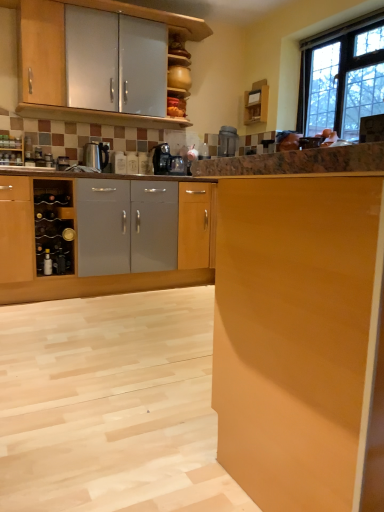
The height and width of the screenshot is (512, 384). What do you see at coordinates (62, 163) in the screenshot? I see `metallic silver wine rack at left, the 2th appliance when ordered from top to bottom` at bounding box center [62, 163].

You are a GUI agent. You are given a task and a screenshot of the screen. Output one action in this format:
    pyautogui.click(x=<x>, y=<y>)
    Task: Click on the metallic silver bottle at lower left
    The height and width of the screenshot is (512, 384).
    Given the screenshot: What is the action you would take?
    pyautogui.click(x=47, y=263)

Find the location of a particular element. This screenshot has width=384, height=512. wooden cabinet at upper center, the first cabinetry positioned from the back is located at coordinates (256, 103).

The image size is (384, 512). In order to click on matte wood cabinet at right, which is counted as the 1th cabinetry, starting from the front in this screenshot , I will do `click(293, 334)`.

Find the location of a particular element. The image size is (384, 512). wooden wine rack at left is located at coordinates (11, 150).

This screenshot has height=512, width=384. I want to click on metallic silver kettle at left, so click(x=96, y=155).

What do you see at coordinates (205, 361) in the screenshot? The image size is (384, 512). I see `light wood cabinet at lower left, the 2th cabinetry from the back` at bounding box center [205, 361].

Locate an element on the screen. light wood cabinet at lower left, the 1th cabinetry when ordered from bottom to top is located at coordinates (205, 361).

I want to click on black plastic coffee machine at center, so click(168, 161).

Can black plastic coffee machine at center be found inside metallic silver toaster at upper center, the second appliance when ordered from left to right?

No, black plastic coffee machine at center is not inside metallic silver toaster at upper center, the second appliance when ordered from left to right.

Could you tell me if metallic silver toaster at upper center, which ranks as the 1th appliance in top-to-bottom order, is turned towards black plastic coffee machine at center?

No.

Considering the positions of objects metallic silver toaster at upper center, which is the 2th appliance in bottom-to-top order, and black plastic coffee machine at center in the image provided, who is more to the left, metallic silver toaster at upper center, which is the 2th appliance in bottom-to-top order, or black plastic coffee machine at center?

From the viewer's perspective, black plastic coffee machine at center appears more on the left side.

Considering the sizes of objects metallic silver toaster at upper center, the second appliance when ordered from left to right, and black plastic coffee machine at center in the image provided, who is shorter, metallic silver toaster at upper center, the second appliance when ordered from left to right, or black plastic coffee machine at center?

Standing shorter between the two is black plastic coffee machine at center.

I want to click on window above the light wood cabinet at lower left, acting as the third cabinetry starting from the top (from a real-world perspective), so click(x=335, y=65).

Is light wood cabinet at lower left, acting as the third cabinetry starting from the top, shorter than clear glass window at upper right?

Correct, light wood cabinet at lower left, acting as the third cabinetry starting from the top, is not as tall as clear glass window at upper right.

Between light wood cabinet at lower left, the 1th cabinetry when ordered from bottom to top, and clear glass window at upper right, which one has larger width?

light wood cabinet at lower left, the 1th cabinetry when ordered from bottom to top.

Between wooden wine rack at left and light wood cabinet at lower left, the 1th cabinetry when ordered from bottom to top, which one appears on the left side from the viewer's perspective?

wooden wine rack at left.

From the image's perspective, is wooden wine rack at left below light wood cabinet at lower left, the 2th cabinetry from the back?

Incorrect, from the image's perspective, wooden wine rack at left is higher than light wood cabinet at lower left, the 2th cabinetry from the back.

Are wooden wine rack at left and light wood cabinet at lower left, the 2th cabinetry from the back, making contact?

No, wooden wine rack at left is not beside light wood cabinet at lower left, the 2th cabinetry from the back.

Does wooden wine rack at left have a smaller size compared to light wood cabinet at lower left, which is the 2th cabinetry from front to back?

Indeed, wooden wine rack at left has a smaller size compared to light wood cabinet at lower left, which is the 2th cabinetry from front to back.

Looking at this image, is clear glass window at upper right facing towards metallic silver toaster at upper center, the second appliance when ordered from left to right?

No, clear glass window at upper right does not turn towards metallic silver toaster at upper center, the second appliance when ordered from left to right.

Who is more distant, clear glass window at upper right or metallic silver toaster at upper center, the 1th appliance when ordered from back to front?

metallic silver toaster at upper center, the 1th appliance when ordered from back to front, is more distant.

How distant is clear glass window at upper right from metallic silver toaster at upper center, the 1th appliance positioned from the right?

The distance of clear glass window at upper right from metallic silver toaster at upper center, the 1th appliance positioned from the right, is 1.18 meters.

Does clear glass window at upper right have a greater width compared to metallic silver toaster at upper center, the 1th appliance positioned from the right?

Incorrect, the width of clear glass window at upper right does not surpass that of metallic silver toaster at upper center, the 1th appliance positioned from the right.

Can you confirm if metallic silver bottle at lower left is thinner than black plastic coffee machine at center?

Indeed, metallic silver bottle at lower left has a lesser width compared to black plastic coffee machine at center.

Is black plastic coffee machine at center at the back of metallic silver bottle at lower left?

No, metallic silver bottle at lower left is not facing the opposite direction of black plastic coffee machine at center.

This screenshot has width=384, height=512. Find the location of `bottle on the left of black plastic coffee machine at center`. bottle on the left of black plastic coffee machine at center is located at coordinates 47,263.

From the image's perspective, which one is positioned higher, metallic silver bottle at lower left or black plastic coffee machine at center?

From the image's view, black plastic coffee machine at center is above.

Which is correct: wooden wine rack at left is inside wooden cabinet at upper center, which appears as the third cabinetry when viewed from the front, or outside of it?

wooden wine rack at left is spatially situated outside wooden cabinet at upper center, which appears as the third cabinetry when viewed from the front.

Does wooden wine rack at left have a larger size compared to wooden cabinet at upper center, the first cabinetry positioned from the back?

No, wooden wine rack at left is not bigger than wooden cabinet at upper center, the first cabinetry positioned from the back.

Looking at this image, from the image's perspective, which is below, wooden wine rack at left or wooden cabinet at upper center, acting as the third cabinetry starting from the bottom?

wooden wine rack at left appears lower in the image.

Is the surface of wooden wine rack at left in direct contact with wooden cabinet at upper center, acting as the third cabinetry starting from the bottom?

wooden wine rack at left is not next to wooden cabinet at upper center, acting as the third cabinetry starting from the bottom, and they're not touching.

Is metallic silver bottle at lower left turned away from metallic silver toaster at upper center, the second appliance when ordered from left to right?

No, metallic silver bottle at lower left is not facing the opposite direction of metallic silver toaster at upper center, the second appliance when ordered from left to right.

Considering the relative sizes of metallic silver bottle at lower left and metallic silver toaster at upper center, the second appliance when ordered from left to right, in the image provided, is metallic silver bottle at lower left shorter than metallic silver toaster at upper center, the second appliance when ordered from left to right,?

Correct, metallic silver bottle at lower left is not as tall as metallic silver toaster at upper center, the second appliance when ordered from left to right.

Which is nearer, (46, 267) or (226, 136)?

Point (46, 267) appears to be closer to the viewer than point (226, 136).

Where is `appliance that is the 2nd object located above the metallic silver bottle at lower left (from the image's perspective)`? appliance that is the 2nd object located above the metallic silver bottle at lower left (from the image's perspective) is located at coordinates (227, 141).

The width and height of the screenshot is (384, 512). There is a black plastic coffee machine at center. What are the coordinates of `appliance above it (from a real-world perspective)` in the screenshot? It's located at (227, 141).

From a real-world perspective, starting from the clear glass window at upper right, which cabinetry is the 3rd one below it? Please provide its 2D coordinates.

[(205, 361)]

Looking at the image, which one is located further to metallic silver bottle at lower left, wooden wine rack at left or metallic silver wine rack at left, positioned as the first appliance in bottom-to-top order?

Based on the image, wooden wine rack at left appears to be further to metallic silver bottle at lower left.

Estimate the real-world distances between objects in this image. Which object is closer to clear glass window at upper right, metallic silver bottle at lower left or wooden cabinet at upper center, acting as the third cabinetry starting from the bottom?

Among the two, wooden cabinet at upper center, acting as the third cabinetry starting from the bottom, is located nearer to clear glass window at upper right.

Based on their spatial positions, is metallic silver bottle at lower left or wooden cabinet at upper center, acting as the third cabinetry starting from the bottom, closer to metallic silver kettle at left?

metallic silver bottle at lower left is closer to metallic silver kettle at left.

From the image, which object appears to be nearer to light wood cabinet at lower left, the 1th cabinetry when ordered from bottom to top, metallic silver toaster at upper center, which ranks as the 1th appliance in top-to-bottom order, or wooden wine rack at left?

metallic silver toaster at upper center, which ranks as the 1th appliance in top-to-bottom order, lies closer to light wood cabinet at lower left, the 1th cabinetry when ordered from bottom to top, than the other object.

When comparing their distances from metallic silver wine rack at left, the 2th appliance viewed from the right, does metallic silver toaster at upper center, which ranks as the 1th appliance in top-to-bottom order, or clear glass window at upper right seem closer?

The object closer to metallic silver wine rack at left, the 2th appliance viewed from the right, is metallic silver toaster at upper center, which ranks as the 1th appliance in top-to-bottom order.

Considering their positions, is wooden wine rack at left positioned further to metallic silver toaster at upper center, which is the 2th appliance in bottom-to-top order, than metallic silver bottle at lower left?

wooden wine rack at left lies further to metallic silver toaster at upper center, which is the 2th appliance in bottom-to-top order, than the other object.

From the image, which object appears to be nearer to metallic silver bottle at lower left, black plastic coffee machine at center or wooden wine rack at left?

Based on the image, wooden wine rack at left appears to be nearer to metallic silver bottle at lower left.

Considering their positions, is light wood cabinet at lower left, the 1th cabinetry when ordered from bottom to top, positioned closer to metallic silver bottle at lower left than metallic silver kettle at left?

Based on the image, metallic silver kettle at left appears to be nearer to metallic silver bottle at lower left.

The height and width of the screenshot is (512, 384). What are the coordinates of `bottle located between wooden wine rack at left and clear glass window at upper right in the left-right direction` in the screenshot? It's located at (47, 263).

Find the location of a particular element. This screenshot has height=512, width=384. kitchen appliance between metallic silver bottle at lower left and wooden cabinet at upper center, which appears as the third cabinetry when viewed from the front, from left to right is located at coordinates (96, 155).

Find the location of a particular element. The image size is (384, 512). bottle between wooden wine rack at left and wooden cabinet at upper center, acting as the third cabinetry starting from the bottom, in the horizontal direction is located at coordinates (47, 263).

Where is `cabinetry located between matte wood cabinet at right, marked as the second cabinetry in a top-to-bottom arrangement, and wooden cabinet at upper center, the 1th cabinetry viewed from the top, in the depth direction`? This screenshot has width=384, height=512. cabinetry located between matte wood cabinet at right, marked as the second cabinetry in a top-to-bottom arrangement, and wooden cabinet at upper center, the 1th cabinetry viewed from the top, in the depth direction is located at coordinates (205, 361).